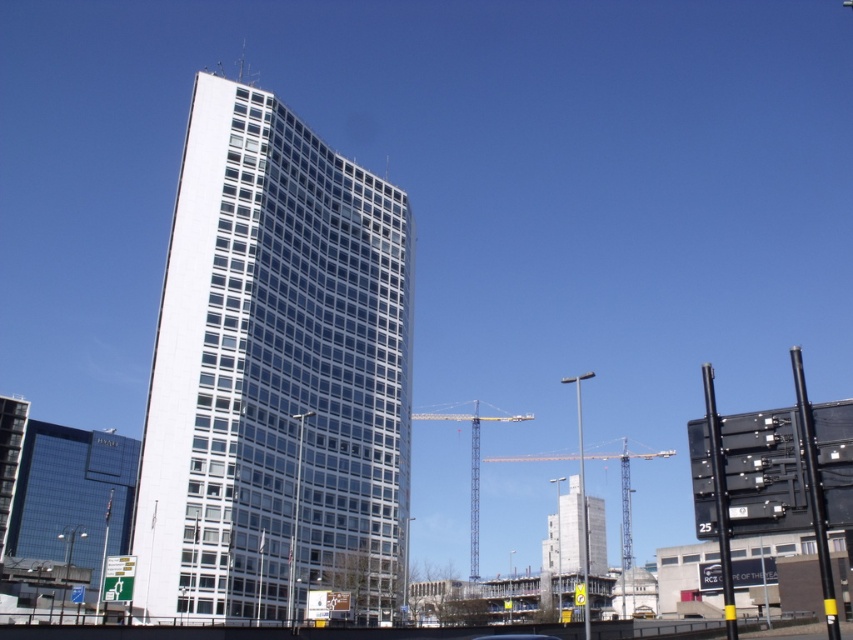
You are standing at the entrance of the white glass building at center. You want to walk straight ahead to reach a nearby park. The park is located at point 0.6, 0.3. Will you walk directly towards the park from your current position?

The white glass building at center is located at point [276,376]. The park is at [254,384]. Since the coordinates are very close, you are already near the park, so walking straight ahead will take you directly towards it.

You are a city planner reviewing the urban layout. You notice the white glass building at center and the white concrete building at center. Which one appears to be located higher up in the image?

The white glass building at center is positioned over the white concrete building at center, so it appears higher up in the image.